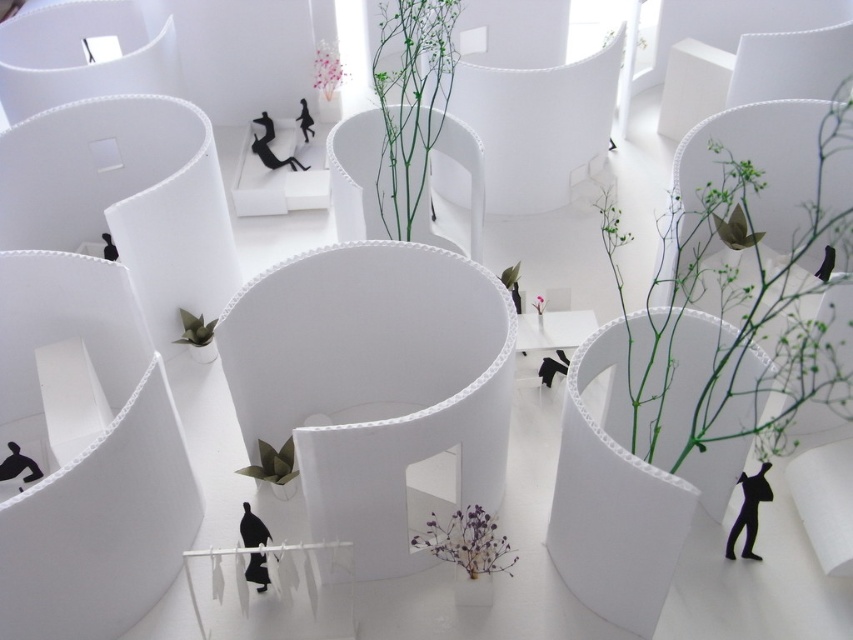
What is the color of the object located at point (410, 100) in the image?

The point (410, 100) indicates a green stem at center, so the color is green.